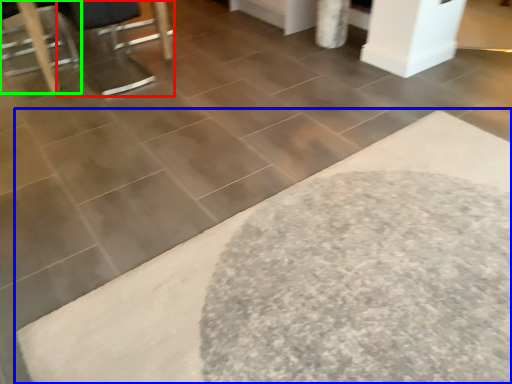
Question: Considering the real-world distances, which object is closest to swivel chair (highlighted by a red box)? bath mat (highlighted by a blue box) or furniture (highlighted by a green box).

Choices:
 (A) bath mat
 (B) furniture

Answer: (B)